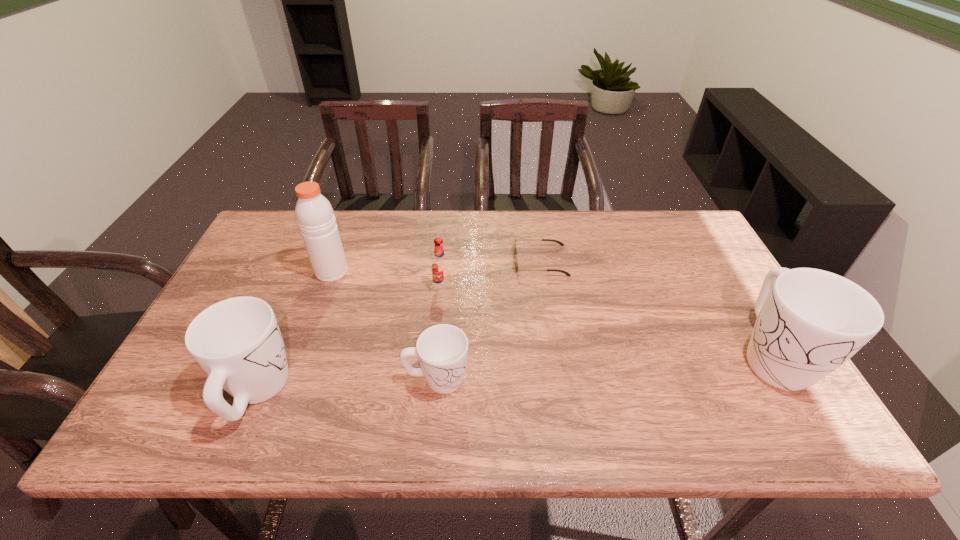
You are a GUI agent. You are given a task and a screenshot of the screen. Output one action in this format:
    pyautogui.click(x=<x>, y=<y>)
    Task: Click on the location for an additional mug to make spacing equal
    The width and height of the screenshot is (960, 540).
    Given the screenshot: What is the action you would take?
    pyautogui.click(x=609, y=367)